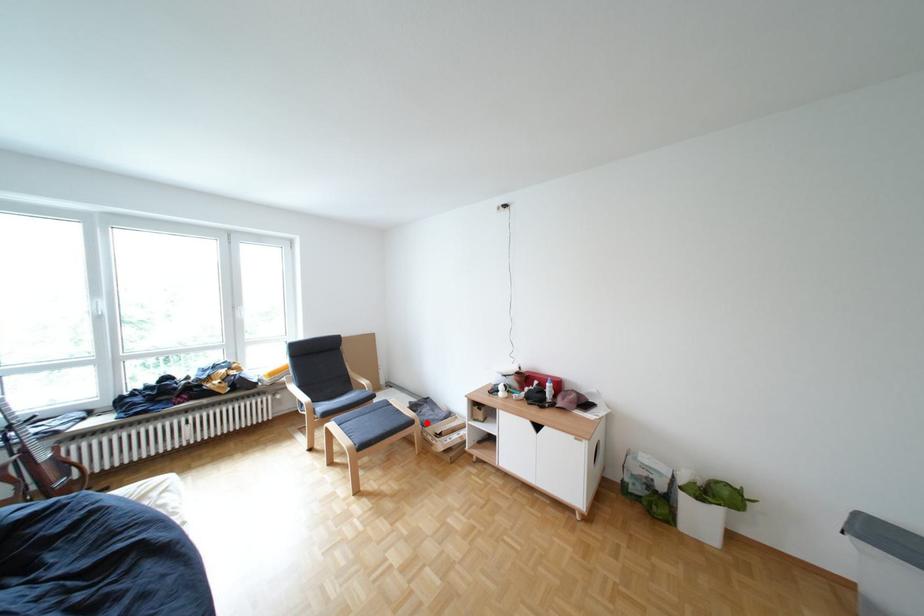
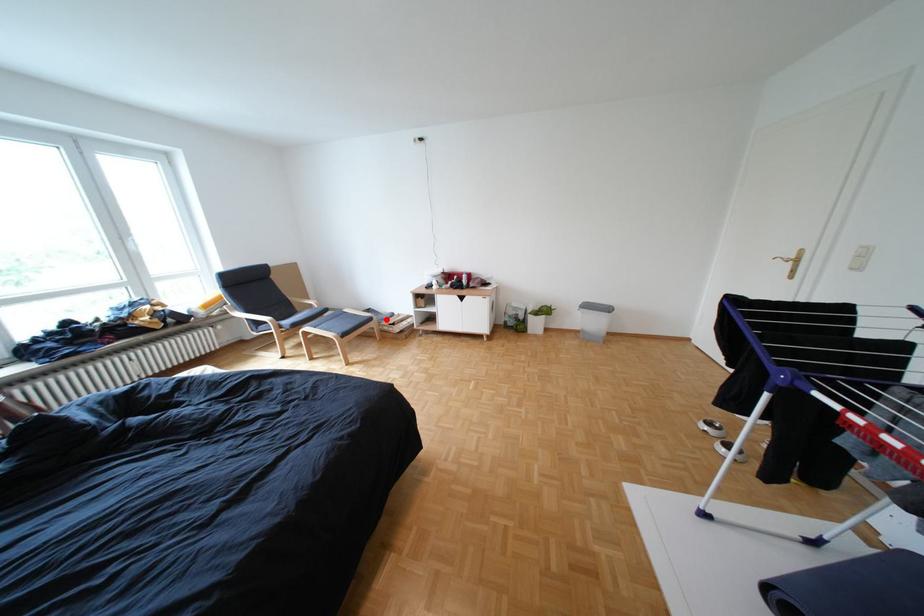
I am providing you with two images of the same scene from different viewpoints. A red point is marked on the first image and another point is marked on the second image. Do the highlighted points in image1 and image2 indicate the same real-world spot?

Yes